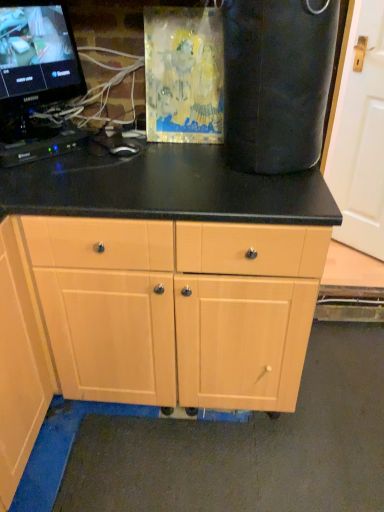
Question: Can you confirm if white matte door at right is positioned to the right of black plastic keyboard at left?

Choices:
 (A) yes
 (B) no

Answer: (A)

Question: Is white matte door at right facing away from black plastic keyboard at left?

Choices:
 (A) no
 (B) yes

Answer: (A)

Question: From a real-world perspective, is white matte door at right physically below black plastic keyboard at left?

Choices:
 (A) no
 (B) yes

Answer: (B)

Question: Is white matte door at right smaller than black plastic keyboard at left?

Choices:
 (A) yes
 (B) no

Answer: (B)

Question: Is white matte door at right to the left of black plastic keyboard at left from the viewer's perspective?

Choices:
 (A) no
 (B) yes

Answer: (A)

Question: From a real-world perspective, does white matte door at right stand above black plastic keyboard at left?

Choices:
 (A) no
 (B) yes

Answer: (A)

Question: Is light wood cabinet at center in front of black glossy monitor at upper left?

Choices:
 (A) yes
 (B) no

Answer: (A)

Question: Is light wood cabinet at center facing towards black glossy monitor at upper left?

Choices:
 (A) yes
 (B) no

Answer: (B)

Question: Considering the relative positions of light wood cabinet at center and black glossy monitor at upper left in the image provided, is light wood cabinet at center to the left of black glossy monitor at upper left from the viewer's perspective?

Choices:
 (A) no
 (B) yes

Answer: (A)

Question: From a real-world perspective, does light wood cabinet at center sit lower than black glossy monitor at upper left?

Choices:
 (A) yes
 (B) no

Answer: (A)

Question: Considering the relative sizes of light wood cabinet at center and black glossy monitor at upper left in the image provided, is light wood cabinet at center shorter than black glossy monitor at upper left?

Choices:
 (A) yes
 (B) no

Answer: (B)

Question: Is light wood cabinet at center surrounding black glossy monitor at upper left?

Choices:
 (A) no
 (B) yes

Answer: (A)

Question: From a real-world perspective, is black plastic keyboard at left on black glossy monitor at upper left?

Choices:
 (A) yes
 (B) no

Answer: (B)